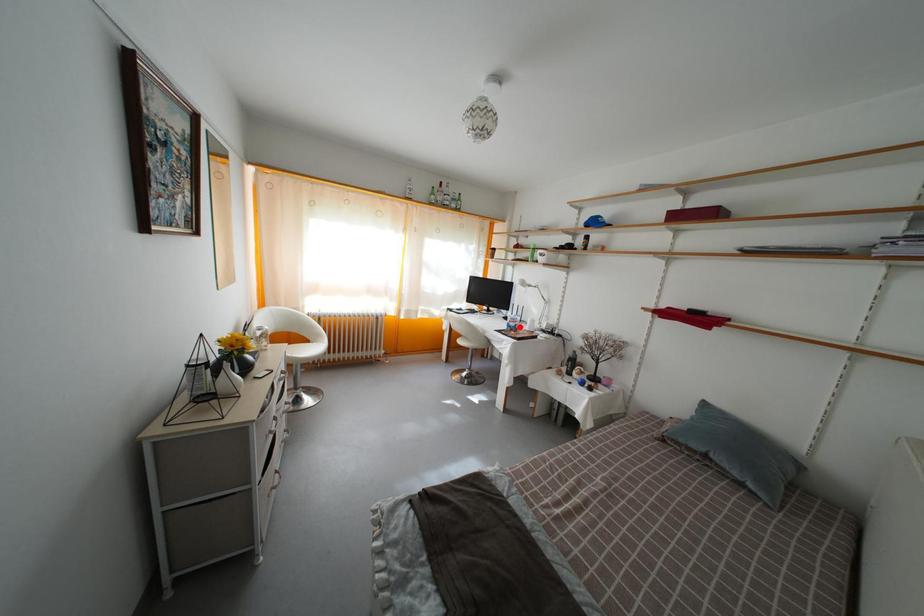
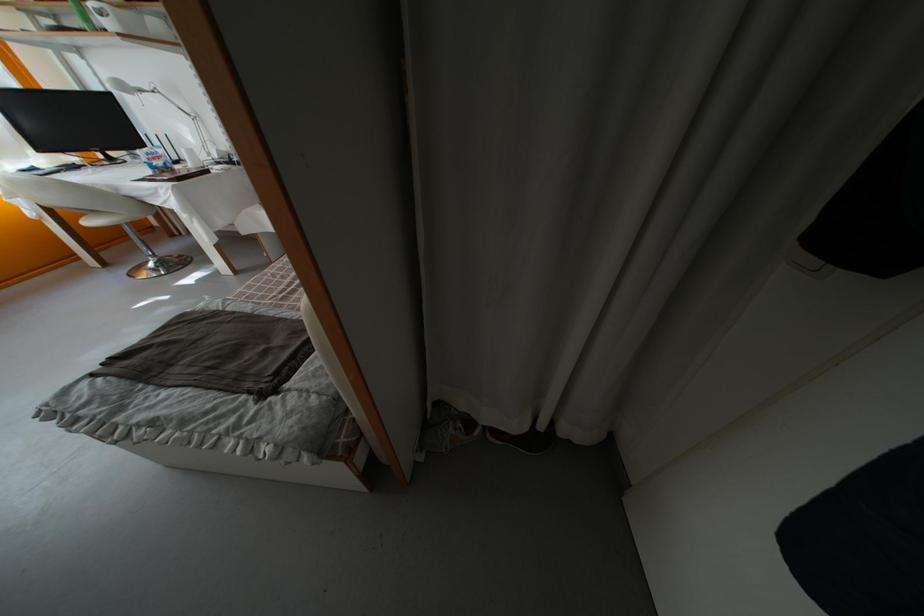
The point at the highlighted location is marked in the first image. Where is the corresponding point in the second image?

(160, 161)